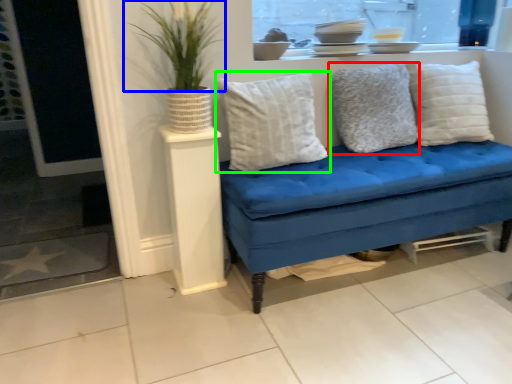
Question: Estimate the real-world distances between objects in this image. Which object is closer to pillow (highlighted by a red box), plant (highlighted by a blue box) or pillow (highlighted by a green box)?

Choices:
 (A) plant
 (B) pillow

Answer: (B)